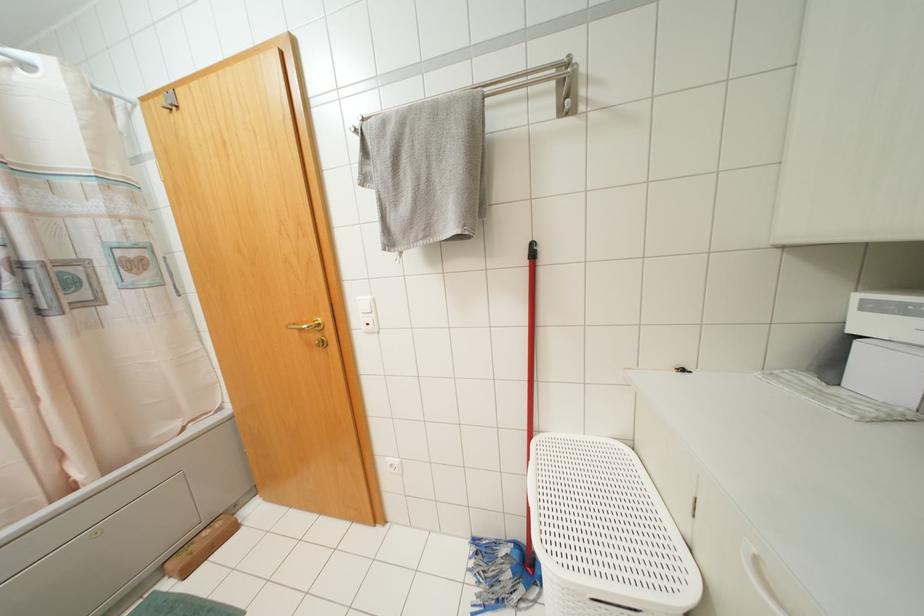
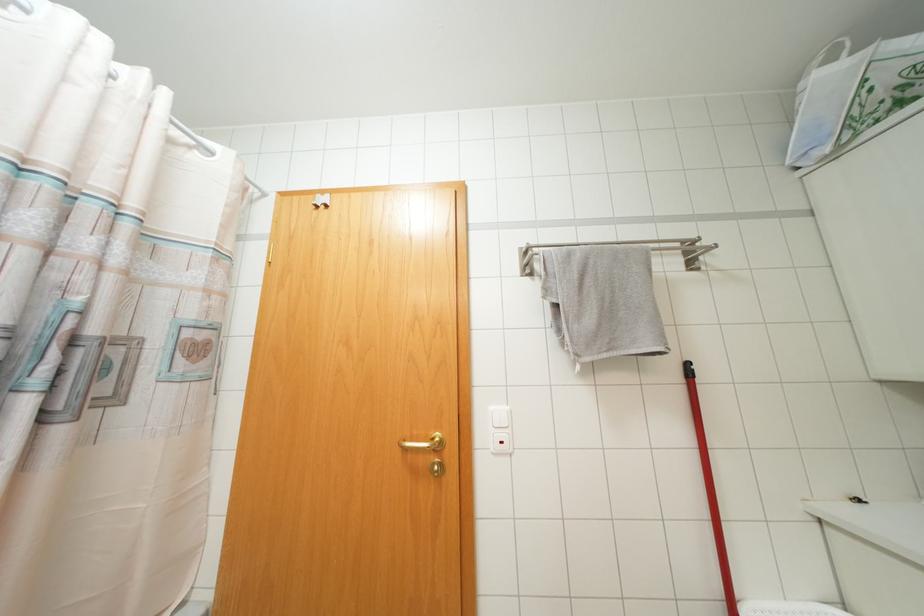
Question: The images are taken continuously from a first-person perspective. In which direction are you moving?

Choices:
 (A) Left
 (B) Right
 (C) Forward
 (D) Backward

Answer: (A)